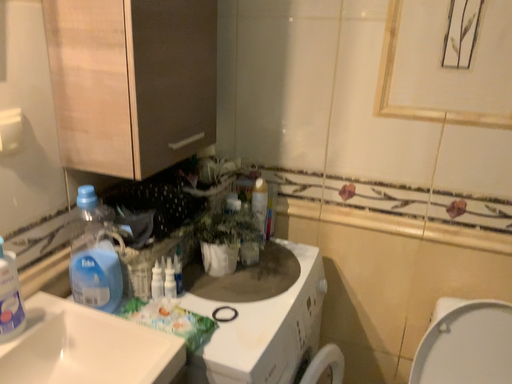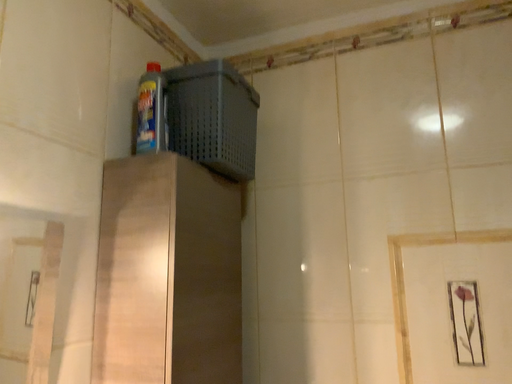
Question: Which way did the camera rotate in the video?

Choices:
 (A) rotated upward
 (B) rotated downward

Answer: (A)